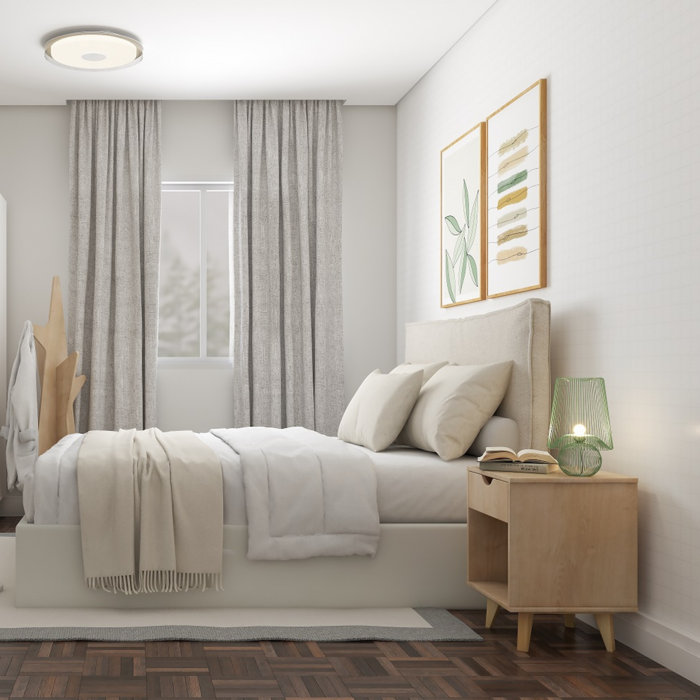
Find the location of a particular element. The image size is (700, 700). two modern pictures in frames is located at coordinates click(x=446, y=153), click(x=490, y=125), click(x=539, y=92), click(x=472, y=133), click(x=442, y=297), click(x=480, y=295), click(x=496, y=290), click(x=540, y=279), click(x=518, y=204), click(x=458, y=213).